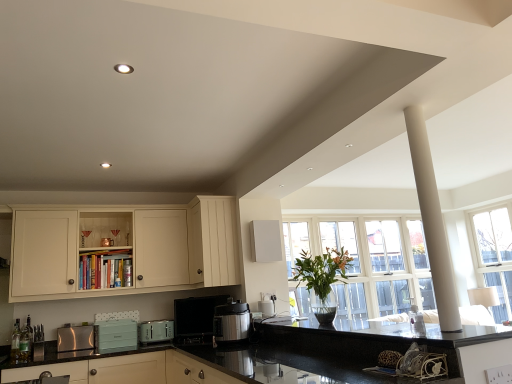
At what (x,y) coordinates should I click in order to perform the action: click on free spot above metallic silver toaster at lower left, acting as the 4th appliance starting from the right (from a real-world perspective). Please return your answer as a coordinate pair (x, y). This screenshot has width=512, height=384. Looking at the image, I should click on (77, 325).